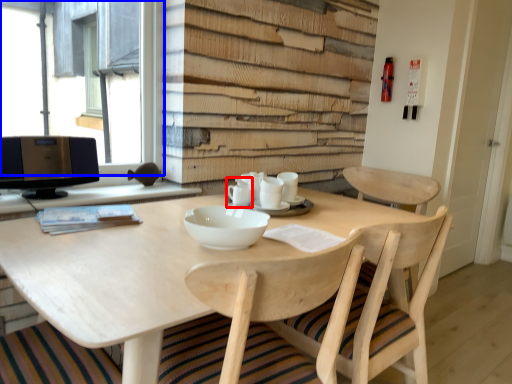
Question: Among these objects, which one is nearest to the camera, tableware (highlighted by a red box) or window (highlighted by a blue box)?

Choices:
 (A) tableware
 (B) window

Answer: (B)